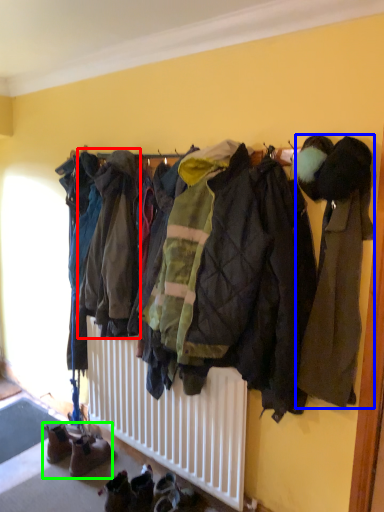
Question: Estimate the real-world distances between objects in this image. Which object is closer to jacket (highlighted by a red box), jacket (highlighted by a blue box) or footwear (highlighted by a green box)?

Choices:
 (A) jacket
 (B) footwear

Answer: (A)